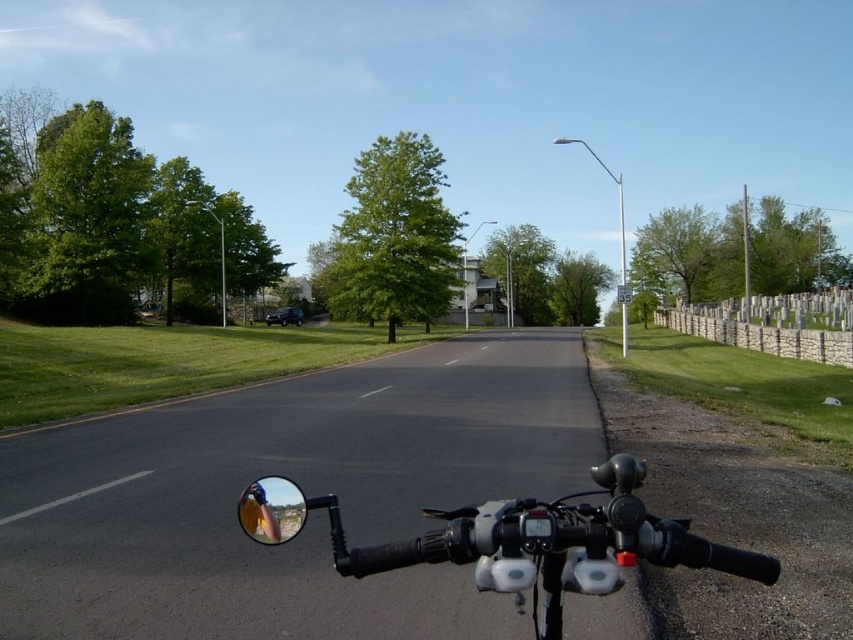
Question: Which point is closer to the camera?

Choices:
 (A) (305, 502)
 (B) (583, 573)
 (C) (299, 506)

Answer: (B)

Question: Which object is closer to the camera taking this photo?

Choices:
 (A) shiny chrome mirror at lower left
 (B) black matte motorcycle handlebars at center

Answer: (B)

Question: Does black matte motorcycle handlebars at center have a smaller size compared to shiny chrome mirror at lower left?

Choices:
 (A) no
 (B) yes

Answer: (A)

Question: Can you confirm if shiny chrome mirror at lower left is positioned above shiny chrome mirror at center?

Choices:
 (A) yes
 (B) no

Answer: (A)

Question: Is black matte motorcycle handlebars at center bigger than shiny chrome mirror at lower left?

Choices:
 (A) no
 (B) yes

Answer: (B)

Question: Which point appears farthest from the camera in this image?

Choices:
 (A) (325, 496)
 (B) (502, 572)
 (C) (265, 506)

Answer: (A)